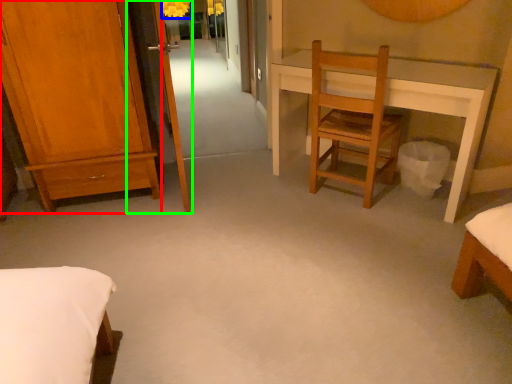
Question: Considering the real-world distances, which object is closest to furniture (highlighted by a red box)? lamp (highlighted by a blue box) or screen door (highlighted by a green box).

Choices:
 (A) lamp
 (B) screen door

Answer: (B)